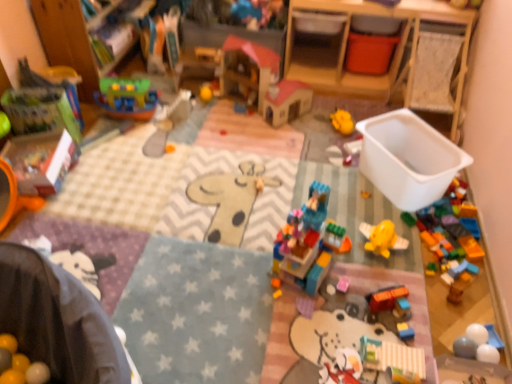
At what (x,y) coordinates should I click in order to perform the action: click on free space to the left of translucent plastic castle at center, marked as the third toy in a bottom-to-top arrangement. Please return your answer as a coordinate pair (x, y). Looking at the image, I should click on (247, 266).